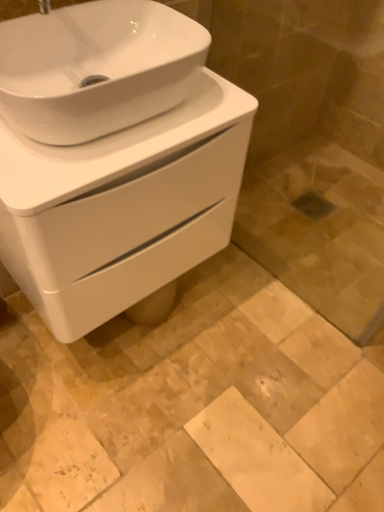
Question: Is white glossy sink at center bigger or smaller than beige marble tile at center?

Choices:
 (A) small
 (B) big

Answer: (B)

Question: Considering their positions, is white glossy sink at center located in front of or behind beige marble tile at center?

Choices:
 (A) behind
 (B) front

Answer: (B)

Question: Which object is the closest to the beige marble tile at center?

Choices:
 (A) transparent glass door at lower right
 (B) white glossy sink at upper left
 (C) white glossy sink at center

Answer: (C)

Question: Which object is positioned closest to the white glossy sink at upper left?

Choices:
 (A) beige marble tile at center
 (B) white glossy sink at center
 (C) transparent glass door at lower right

Answer: (B)